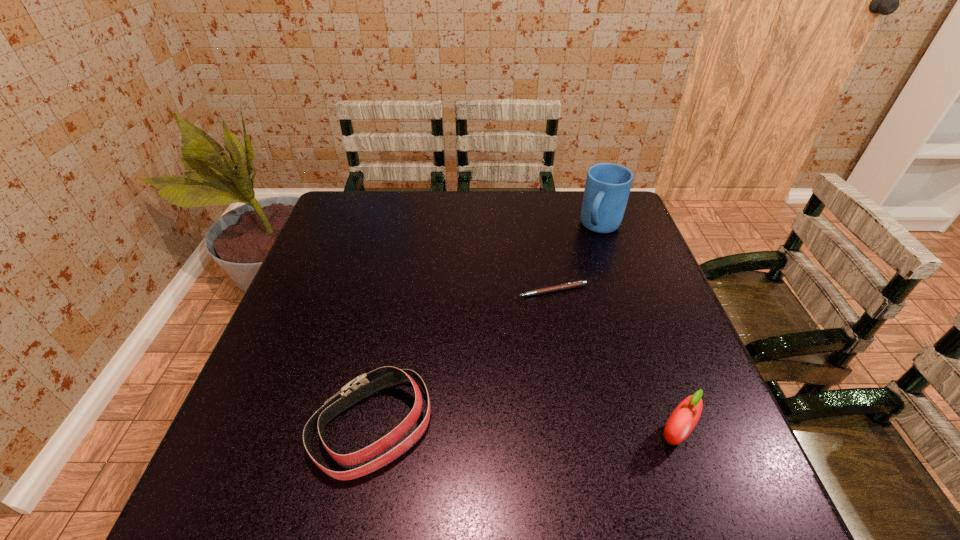
What are the coordinates of `vacant spot on the desktop that is between the leftmost object and the apple and is positioned on the side of the tallest object with the handle` in the screenshot? It's located at 482,430.

Locate an element on the screen. The image size is (960, 540). free space on the desktop that is between the dog collar and the apple and is positioned at the nib of the pen is located at coordinates (515, 431).